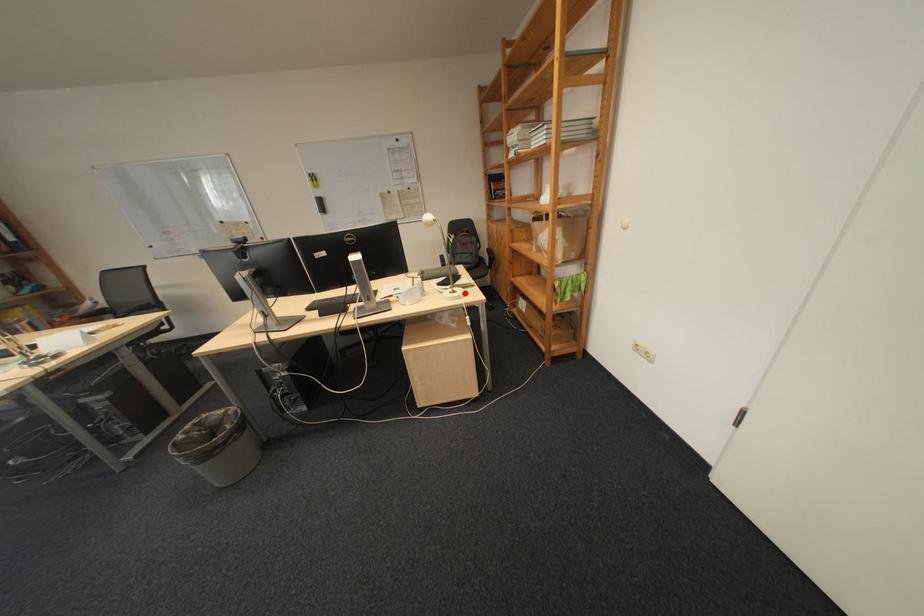
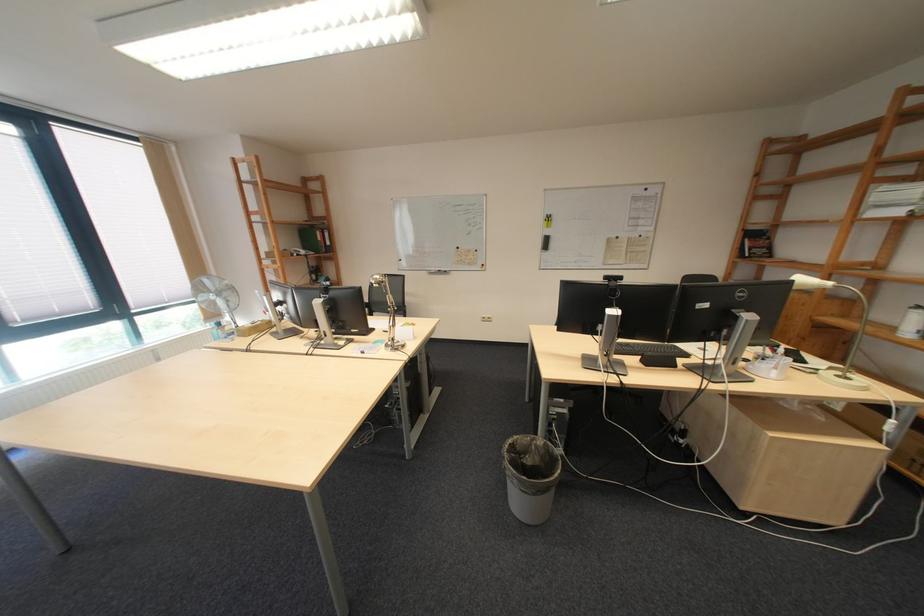
Question: A red point is marked in image1. In image2, is the corresponding 3D point closer to the camera or farther? Reply with the corresponding letter.

Choices:
 (A) The corresponding 3D point is closer.
 (B) The corresponding 3D point is farther.

Answer: (A)